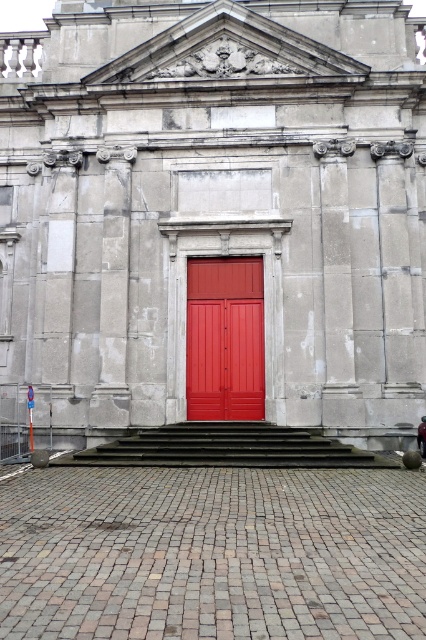
Question: Is matte red door at center thinner than smooth concrete stairs at center?

Choices:
 (A) yes
 (B) no

Answer: (A)

Question: Which of the following is the closest to the observer?

Choices:
 (A) (227, 360)
 (B) (207, 1)
 (C) (92, 449)

Answer: (C)

Question: Can you confirm if smooth red door at center is wider than matte red door at center?

Choices:
 (A) no
 (B) yes

Answer: (B)

Question: Can you confirm if smooth red door at center is positioned to the left of matte red door at center?

Choices:
 (A) yes
 (B) no

Answer: (A)

Question: Among these points, which one is nearest to the camera?

Choices:
 (A) (290, 164)
 (B) (264, 413)
 (C) (284, 456)

Answer: (C)

Question: Which object is the closest to the smooth red door at center?

Choices:
 (A) smooth concrete stairs at center
 (B) matte red door at center

Answer: (B)